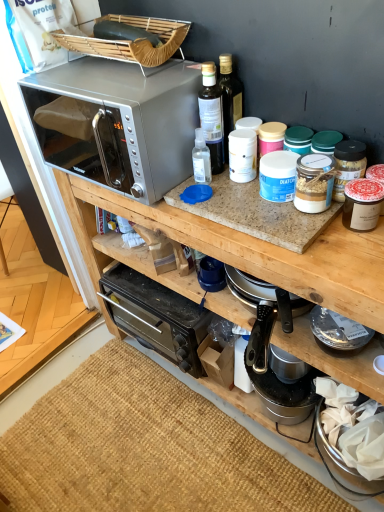
Find the location of a particular element. This screenshot has width=384, height=512. free spot below burlap mat at lower center (from a real-world perspective) is located at coordinates (139, 449).